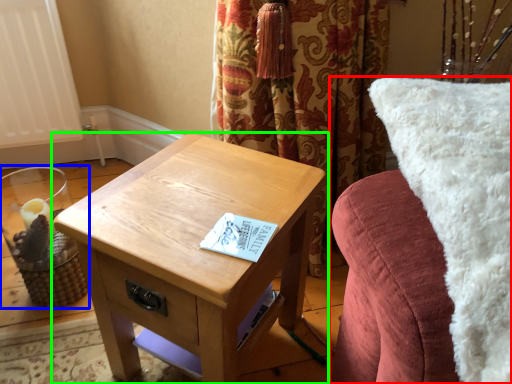
Question: Considering the real-world distances, which object is closest to furniture (highlighted by a red box)? candle holder (highlighted by a blue box) or table (highlighted by a green box).

Choices:
 (A) candle holder
 (B) table

Answer: (B)